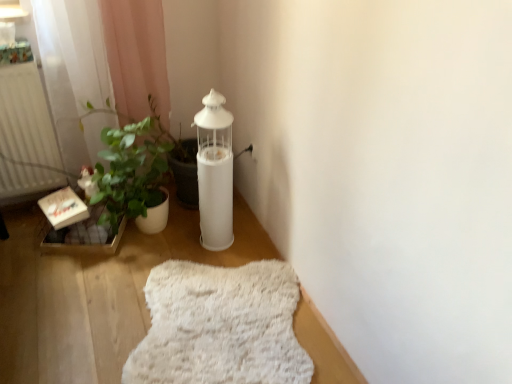
The width and height of the screenshot is (512, 384). What are the coordinates of `vacant area on top of white fluffy rug at lower center (from a real-world perspective)` in the screenshot? It's located at (226, 313).